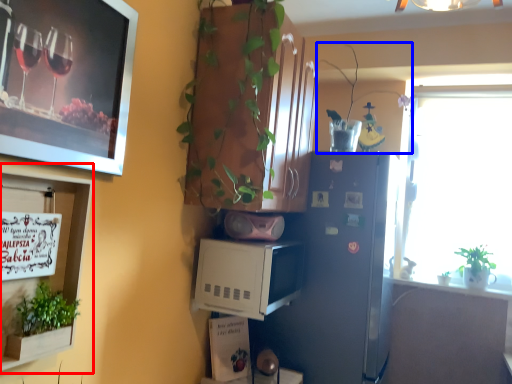
Question: Which point is further to the camera, shelf (highlighted by a red box) or houseplant (highlighted by a blue box)?

Choices:
 (A) shelf
 (B) houseplant

Answer: (B)